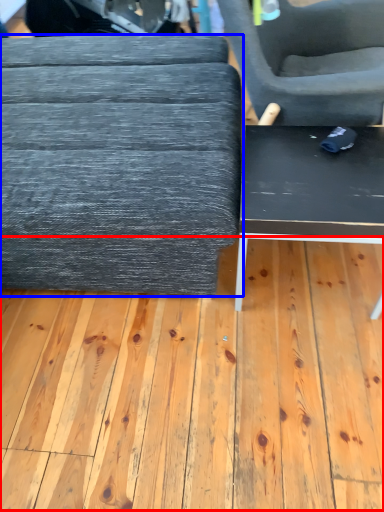
Question: Which object is further to the camera taking this photo, plywood (highlighted by a red box) or table (highlighted by a blue box)?

Choices:
 (A) plywood
 (B) table

Answer: (A)